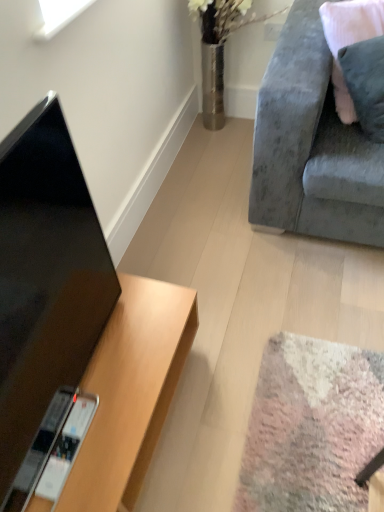
What are the coordinates of `vacant area to the right of black glossy tv at left` in the screenshot? It's located at (130, 370).